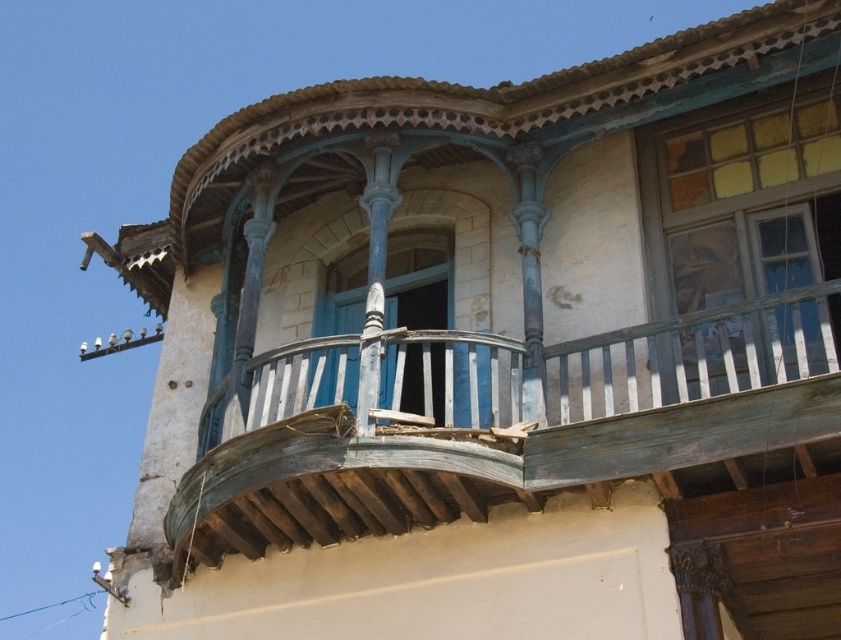
Question: Which object appears farthest from the camera in this image?

Choices:
 (A) blue painted wood at center
 (B) yellow glass window at upper right

Answer: (A)

Question: Which object is positioned closest to the weathered wood balcony at center?

Choices:
 (A) yellow glass window at upper right
 (B) blue painted wood at center

Answer: (B)

Question: Does weathered wood balcony at center come in front of yellow glass window at upper right?

Choices:
 (A) yes
 (B) no

Answer: (A)

Question: Where is weathered wood balcony at center located in relation to yellow glass window at upper right in the image?

Choices:
 (A) below
 (B) above

Answer: (A)

Question: Is weathered wood balcony at center closer to the viewer compared to blue painted wood at center?

Choices:
 (A) no
 (B) yes

Answer: (B)

Question: Among these points, which one is farthest from the camera?

Choices:
 (A) (636, 458)
 (B) (347, 275)
 (C) (643, 147)

Answer: (B)